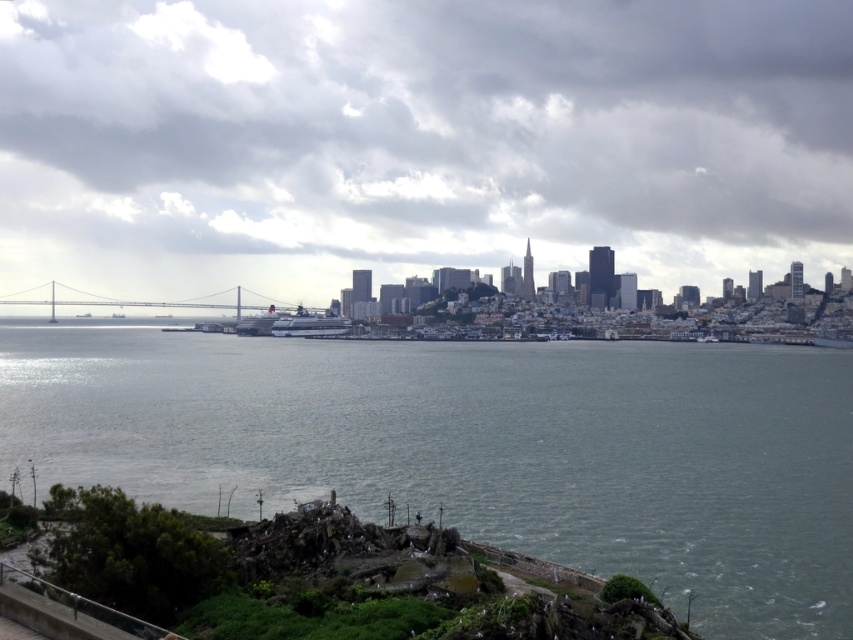
Question: Among these objects, which one is nearest to the camera?

Choices:
 (A) metallic gray bridge at center
 (B) cloudy sky at upper center

Answer: (B)

Question: Can you confirm if gray water at center is positioned below metallic gray bridge at center?

Choices:
 (A) yes
 (B) no

Answer: (A)

Question: Observing the image, what is the correct spatial positioning of gray water at center in reference to metallic gray bridge at center?

Choices:
 (A) right
 (B) left

Answer: (A)

Question: Which object is positioned closest to the gray water at center?

Choices:
 (A) metallic gray bridge at center
 (B) cloudy sky at upper center

Answer: (B)

Question: Where is cloudy sky at upper center located in relation to gray water at center in the image?

Choices:
 (A) below
 (B) above

Answer: (B)

Question: Among these points, which one is nearest to the camera?

Choices:
 (A) (741, 244)
 (B) (230, 305)
 (C) (131, 426)

Answer: (C)